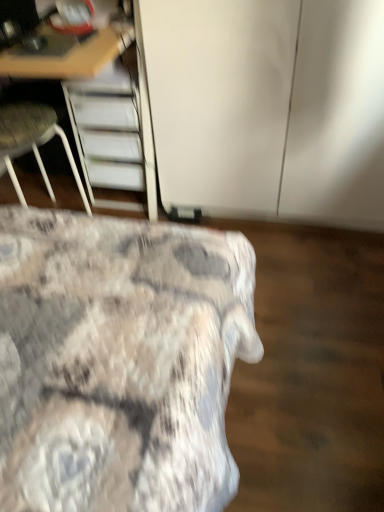
Question: Considering the positions of white glossy cabinet at upper center and wooden desk at upper left in the image, is white glossy cabinet at upper center wider or thinner than wooden desk at upper left?

Choices:
 (A) wide
 (B) thin

Answer: (B)

Question: Choose the correct answer: Is white glossy cabinet at upper center inside wooden desk at upper left or outside it?

Choices:
 (A) outside
 (B) inside

Answer: (A)

Question: Estimate the real-world distances between objects in this image. Which object is farther from the white fabric chair at left?

Choices:
 (A) wooden desk at upper left
 (B) textured fabric bed at lower left
 (C) white glossy cabinet at upper center

Answer: (B)

Question: Which of these objects is positioned closest to the white glossy cabinet at upper center?

Choices:
 (A) textured fabric bed at lower left
 (B) white fabric chair at left
 (C) wooden desk at upper left

Answer: (C)